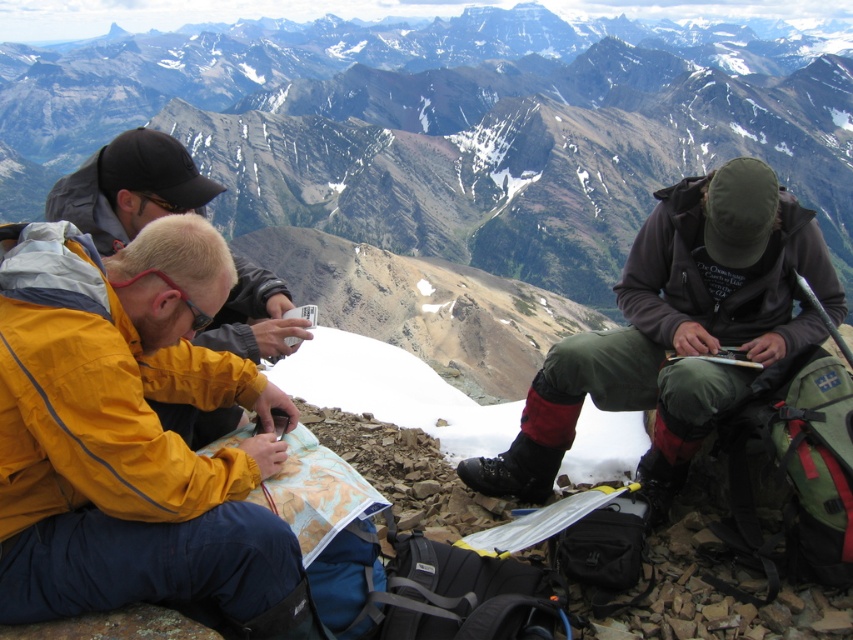
What is the 2D coordinate of the rocky mountain range at center?

The 2D coordinate of the rocky mountain range at center is at point [457,128].

Looking at this image, you are a hiker trying to locate the person in the yellow waterproof jacket at lower left from your current position near the dark brown jacket at right. Which direction should you move to find them?

The yellow waterproof jacket at lower left is below the dark brown jacket at right. To locate the yellow waterproof jacket at lower left, you should move downward from the dark brown jacket at right.